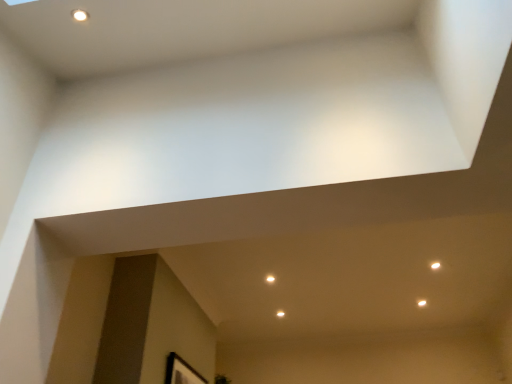
Describe the element at coordinates (181, 372) in the screenshot. The image size is (512, 384). I see `black matte picture frame at lower right` at that location.

What is the approximate width of black matte picture frame at lower right?

black matte picture frame at lower right is 2.73 inches in width.

This screenshot has width=512, height=384. I want to click on black matte picture frame at lower right, so click(181, 372).

Image resolution: width=512 pixels, height=384 pixels. What do you see at coordinates (270, 279) in the screenshot?
I see `white glossy light at center` at bounding box center [270, 279].

The width and height of the screenshot is (512, 384). Identify the location of white glossy light at center. (270, 279).

Locate an element on the screen. black matte picture frame at lower right is located at coordinates (181, 372).

Which is more to the right, white glossy light at center or black matte picture frame at lower right?

From the viewer's perspective, white glossy light at center appears more on the right side.

Considering the relative positions of white glossy light at center and black matte picture frame at lower right in the image provided, is white glossy light at center in front of black matte picture frame at lower right?

No.

Is point (267, 281) closer to viewer compared to point (207, 381)?

Yes, it is.

In the scene shown: From the image's perspective, would you say white glossy light at center is positioned over black matte picture frame at lower right?

Yes.

From a real-world perspective, between white glossy light at center and black matte picture frame at lower right, who is vertically lower?

From a 3D spatial view, black matte picture frame at lower right is below.

Considering the relative sizes of white glossy light at center and black matte picture frame at lower right in the image provided, is white glossy light at center wider than black matte picture frame at lower right?

Yes.

Can you confirm if white glossy light at center is taller than black matte picture frame at lower right?

Incorrect, the height of white glossy light at center is not larger of that of black matte picture frame at lower right.

In terms of size, does white glossy light at center appear bigger or smaller than black matte picture frame at lower right?

white glossy light at center is smaller than black matte picture frame at lower right.

Would you say white glossy light at center is inside or outside black matte picture frame at lower right?

white glossy light at center lies outside black matte picture frame at lower right.

Does white glossy light at center touch black matte picture frame at lower right?

No, white glossy light at center is not touching black matte picture frame at lower right.

Is white glossy light at center facing away from black matte picture frame at lower right?

white glossy light at center is not turned away from black matte picture frame at lower right.

How different are the orientations of white glossy light at center and black matte picture frame at lower right in degrees?

white glossy light at center and black matte picture frame at lower right are facing 1.96 degrees away from each other.

Identify the location of picture frame below the white glossy light at center (from the image's perspective). The image size is (512, 384). (181, 372).

Visually, is black matte picture frame at lower right positioned to the left or to the right of white glossy light at center?

From the image, it's evident that black matte picture frame at lower right is to the left of white glossy light at center.

Does black matte picture frame at lower right come in front of white glossy light at center?

Yes, black matte picture frame at lower right is closer to the viewer.

Considering the points (172, 365) and (269, 278), which point is in front, point (172, 365) or point (269, 278)?

The point (172, 365) is closer to the camera.

From the image's perspective, which one is positioned higher, black matte picture frame at lower right or white glossy light at center?

white glossy light at center is shown above in the image.

From a real-world perspective, which is physically below, black matte picture frame at lower right or white glossy light at center?

black matte picture frame at lower right is physically lower.

Is black matte picture frame at lower right thinner than white glossy light at center?

Correct, the width of black matte picture frame at lower right is less than that of white glossy light at center.

From their relative heights in the image, would you say black matte picture frame at lower right is taller or shorter than white glossy light at center?

In the image, black matte picture frame at lower right appears to be taller than white glossy light at center.

Does black matte picture frame at lower right have a larger size compared to white glossy light at center?

Yes, black matte picture frame at lower right is bigger than white glossy light at center.

Is black matte picture frame at lower right situated inside white glossy light at center or outside?

black matte picture frame at lower right is not enclosed by white glossy light at center.

Are black matte picture frame at lower right and white glossy light at center far apart?

black matte picture frame at lower right is far away from white glossy light at center.

Is white glossy light at center at the back of black matte picture frame at lower right?

black matte picture frame at lower right does not have its back to white glossy light at center.

How many degrees apart are the facing directions of black matte picture frame at lower right and white glossy light at center?

There is a 1.96-degree angle between the facing directions of black matte picture frame at lower right and white glossy light at center.

How much distance is there between black matte picture frame at lower right and white glossy light at center?

black matte picture frame at lower right and white glossy light at center are 1.15 meters apart.

Locate an element on the screen. Image resolution: width=512 pixels, height=384 pixels. picture frame that appears in front of the white glossy light at center is located at coordinates (181, 372).

Identify the location of light above the black matte picture frame at lower right (from the image's perspective). (270, 279).

Find the location of `picture frame in front of the white glossy light at center`. picture frame in front of the white glossy light at center is located at coordinates (181, 372).